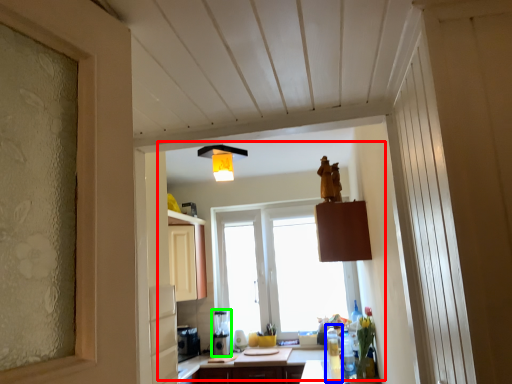
Question: Considering the real-world distances, which object is farthest from bay window (highlighted by a red box)? bottle (highlighted by a blue box) or coffee machine (highlighted by a green box)?

Choices:
 (A) bottle
 (B) coffee machine

Answer: (A)